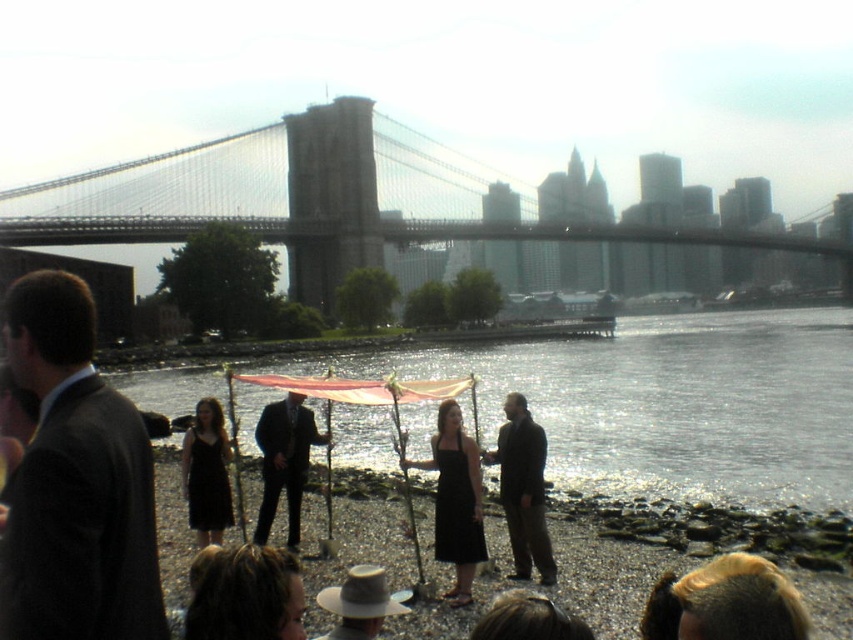
You are attending an outdoor event near the waterfront and see the black satin dress at center and the brown felt hat at lower center. Which object is closer to you?

The black satin dress at center is closer to you because it is further to the viewer than the brown felt hat at lower center.

You are standing at the camera position observing the waterfront scene. There is a point marked at coordinates point (509, 509). If you want to place a 10 meter long boat exactly at that point, will it fit entirely within the visible water area?

The point (509, 509) is 70.36 meters away from the camera. Since the boat is only 10 meters long, it will fit entirely within the visible water area as there is sufficient space around the point to accommodate its length.